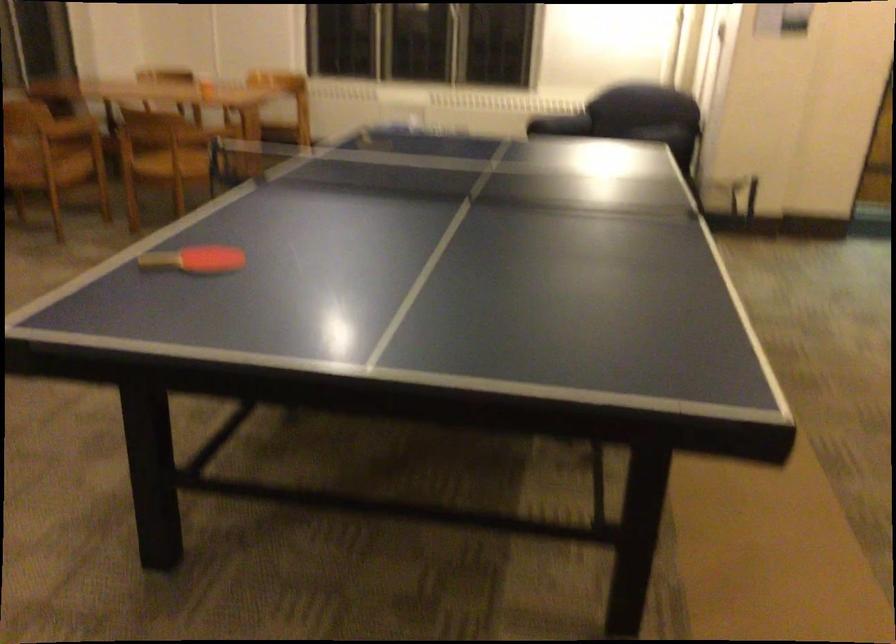
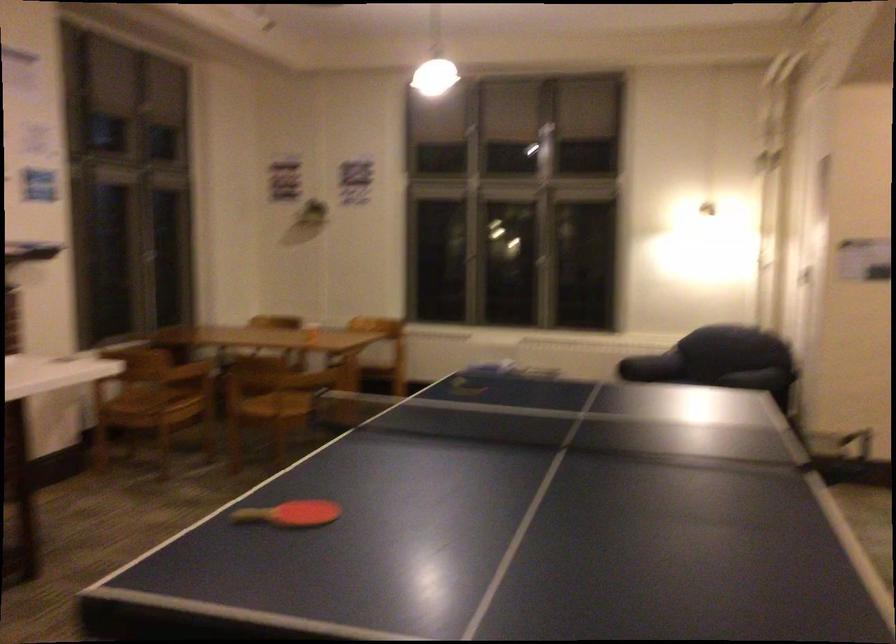
What movement of the cameraman would produce the second image?

The movement direction of the cameraman is left, forward.